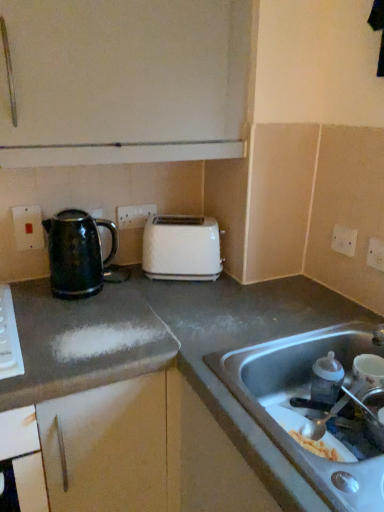
This screenshot has width=384, height=512. I want to click on vacant space to the right of white plastic toaster at center, so click(x=241, y=286).